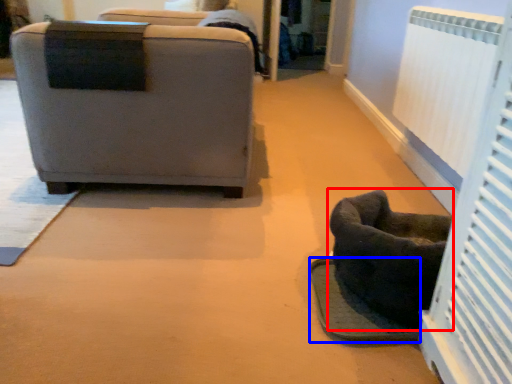
Question: Which object is further to the camera taking this photo, furniture (highlighted by a red box) or footrest (highlighted by a blue box)?

Choices:
 (A) furniture
 (B) footrest

Answer: (B)